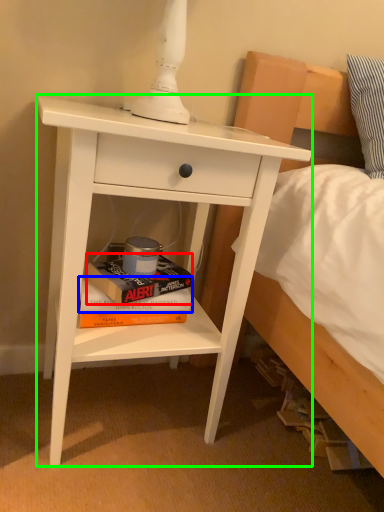
Question: Which object is positioned closest to paperback book (highlighted by a red box)? Select from paperback book (highlighted by a blue box) and nightstand (highlighted by a green box).

Choices:
 (A) paperback book
 (B) nightstand

Answer: (A)